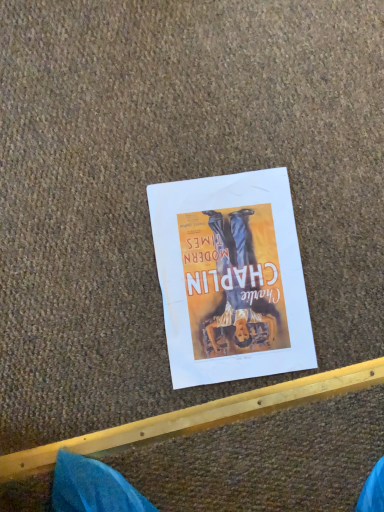
What are the coordinates of `free space above white paper poster at center (from a real-world perspective)` in the screenshot? It's located at (235, 276).